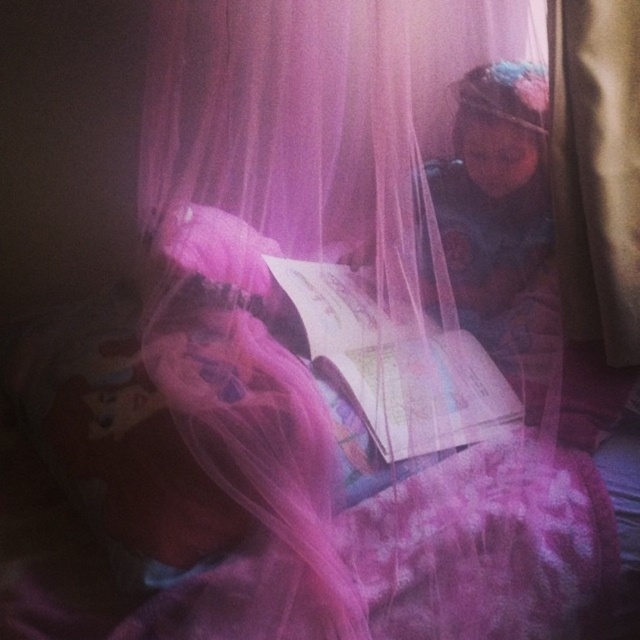
You are trying to decide whether to place a new decorative item on the brown fabric curtain at right or the matte paper book at center. Based on their sizes, which surface can accommodate a larger item?

The matte paper book at center is larger than the brown fabric curtain at right, so it can accommodate a larger item.

You are a delivery robot that needs to place a small package between the brown fabric curtain at right and the matte paper book at center. The package is 12 inches long. Can you fit it between them without moving either object?

The brown fabric curtain at right and matte paper book at center are 12.20 inches apart from each other. Since the package is 12 inches long, which is shorter than the available space, the robot can fit the package between them.

You are a parent trying to hang a new picture frame that is 1 meter tall on the wall next to the brown fabric curtain at right and the matte paper book at center. Which object should you place the frame next to so it won

The brown fabric curtain at right is much taller than the matte paper book at center, so the picture frame that is 1 meter tall would be better placed next to the brown fabric curtain at right to maintain proportion.